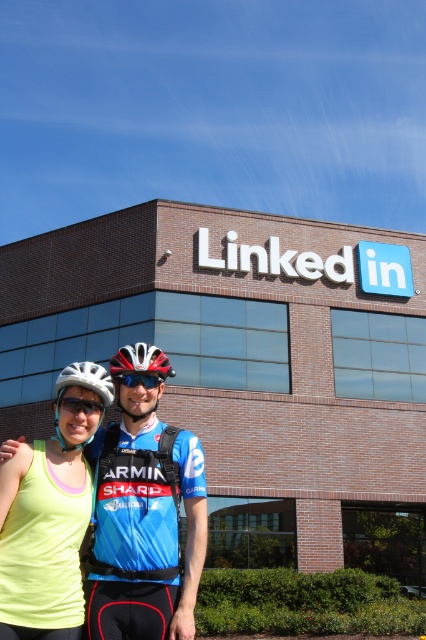
You are standing at the point marked by the coordinates point (x=152, y=422) and want to take a photo of the LinkedIn building. Considering the distance between you and the viewer is 5.90 meters, will you be able to capture the entire building in your shot if your camera has a 50mm lens?

The distance between you and the viewer is 5.90 meters. However, the question mentions capturing the entire LinkedIn building, but the provided information does not specify the building dimensions or the field of view of the 50mm lens. Without knowing the building size or the lens field of view, it is impossible to determine if the entire building will fit in the photo.

You are a photographer taking a picture of the LinkedIn building with two people in front of it. You notice an object at point (x=80, y=404) in the image. What is the object at that coordinate?

The object at point (x=80, y=404) is clear plastic goggles at center.

You are a photographer standing at the center of the scene. You want to capture a photo where the white matte helmet at left is centered in the frame. Given its current position at point coordinates, can you adjust your position to achieve this?

The white matte helmet at left is already positioned at point coordinates, so adjusting your position to center it in the frame would require moving to the left to align the camera with the helmet.